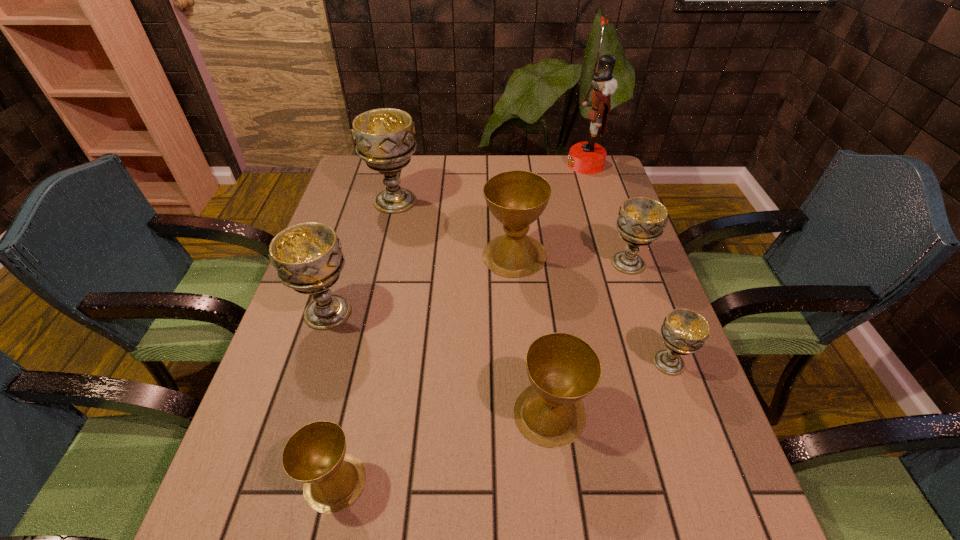
The height and width of the screenshot is (540, 960). Identify the location of vacant space at the left edge. (348, 207).

In the image, there is a desktop. Find the location of `free space at the right edge`. free space at the right edge is located at coordinates (664, 346).

This screenshot has height=540, width=960. What are the coordinates of `vacant position at the far right corner of the desktop` in the screenshot? It's located at (612, 190).

Where is `free space between the farthest brown chalice and the second farthest object`? free space between the farthest brown chalice and the second farthest object is located at coordinates (455, 228).

Identify the location of free area in between the nearest chalice and the third smallest white chalice. (331, 397).

The width and height of the screenshot is (960, 540). I want to click on empty location between the farthest brown chalice and the second farthest brown chalice, so click(532, 334).

Find the location of `vacant area between the third smallest white chalice and the smallest brown chalice`. vacant area between the third smallest white chalice and the smallest brown chalice is located at coordinates (331, 397).

Image resolution: width=960 pixels, height=540 pixels. I want to click on free space between the sixth farthest chalice and the farthest brown chalice, so click(x=532, y=334).

I want to click on free space between the farthest brown chalice and the red nutcracker, so click(550, 210).

This screenshot has width=960, height=540. Find the location of `empty location between the leftmost brown chalice and the second nearest object`. empty location between the leftmost brown chalice and the second nearest object is located at coordinates (443, 448).